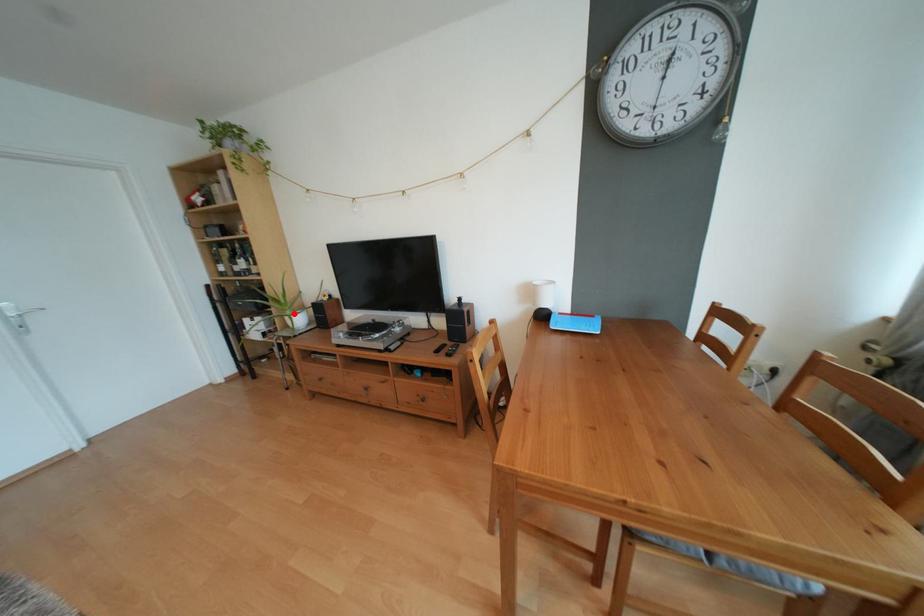
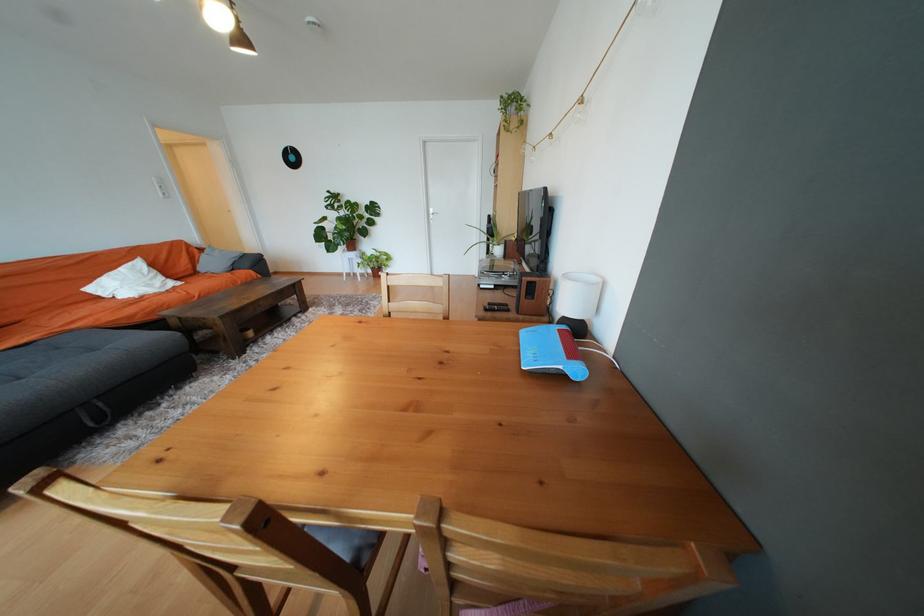
Question: I am providing you with two images of the same scene from different viewpoints. A red point is shown in image1. For the corresponding object point in image2, is it positioned nearer or farther from the camera?

Choices:
 (A) Nearer
 (B) Farther

Answer: (A)